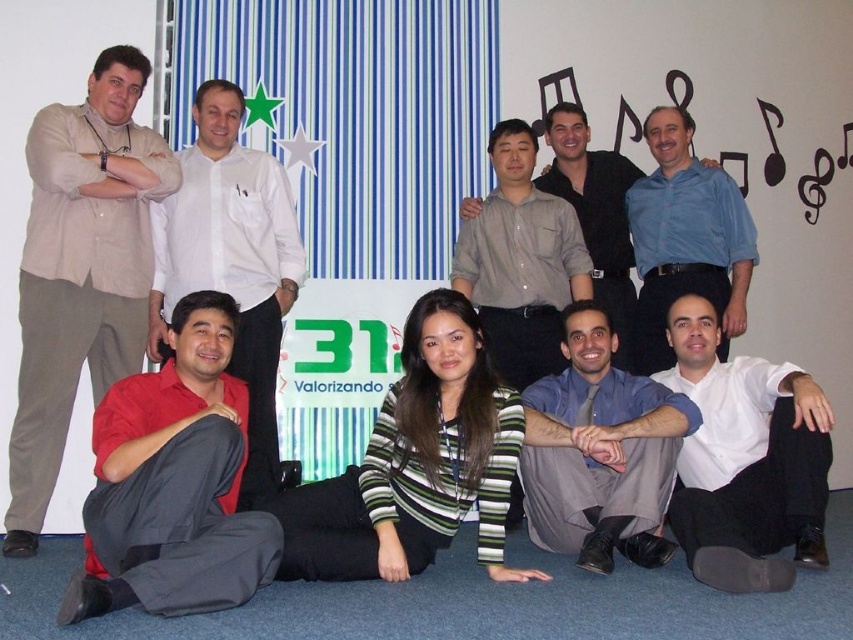
You are a photographer adjusting the camera height to ensure both the beige linen shirt at left and the white glossy shirt at lower right are fully visible in the frame. Which shirt should you position the camera closer to?

The beige linen shirt at left is taller than the white glossy shirt at lower right, so positioning the camera closer to the beige linen shirt at left will ensure both shirts are fully visible in the frame.

You are a photographer taking a group photo. The beige linen shirt at left is at coordinate point (80,269). Where should you position your camera to ensure the beige linen shirt at left is centered in the frame?

The beige linen shirt at left is located at coordinate point (80,269). To center it in the frame, position your camera so that the center of the frame aligns with this coordinate point.

You are a photographer who wants to ensure that all participants in the photo are visible. The white glossy shirt at lower right and the blue shirt at center are both important. Based on their positions, which of these two shirts is closer to the camera?

The white glossy shirt at lower right is below the blue shirt at center, meaning it is closer to the camera.